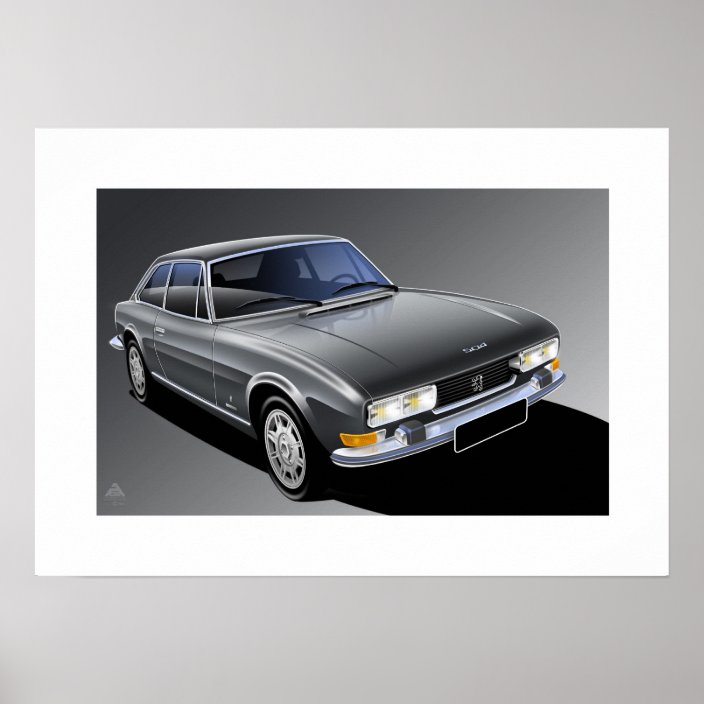
Where is `artwork`? This screenshot has width=704, height=704. artwork is located at coordinates (579, 496).